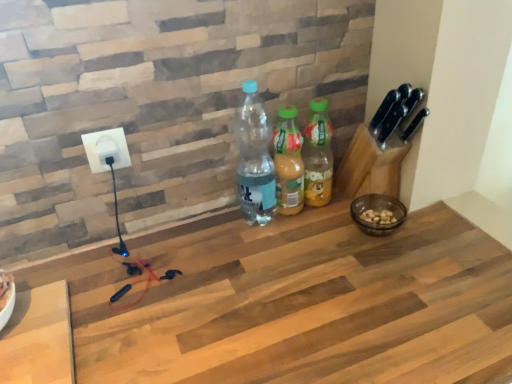
Question: From their relative heights in the image, would you say white plastic socket at upper left is taller or shorter than translucent plastic bottle at center, the 2th bottle from the left?

Choices:
 (A) tall
 (B) short

Answer: (B)

Question: From the image's perspective, is white plastic socket at upper left located above or below translucent plastic bottle at center, the 2th bottle from the left?

Choices:
 (A) below
 (B) above

Answer: (B)

Question: Which object is positioned farthest from the translucent plastic bottle at center, the 2th bottle from the left?

Choices:
 (A) translucent plastic bottle at center, arranged as the first bottle when viewed from the right
 (B) white plastic socket at upper left
 (C) wooden at center
 (D) transparent plastic bottle at center, which is the first bottle in left-to-right order

Answer: (B)

Question: Which of these objects is positioned farthest from the white plastic socket at upper left?

Choices:
 (A) translucent plastic bottle at center, arranged as the first bottle when viewed from the right
 (B) wooden at center
 (C) transparent plastic bottle at center, which is the first bottle in left-to-right order
 (D) translucent plastic bottle at center, the 2th bottle from the left

Answer: (B)